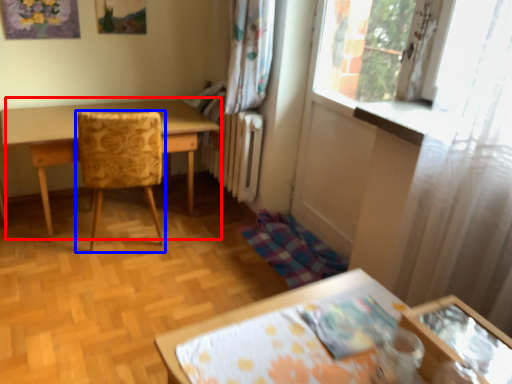
Question: Which object appears closest to the camera in this image, table (highlighted by a red box) or chair (highlighted by a blue box)?

Choices:
 (A) table
 (B) chair

Answer: (B)